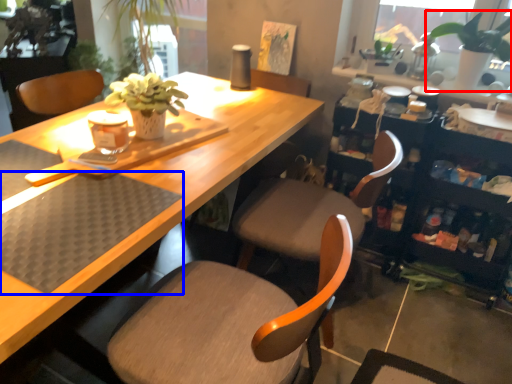
Question: Which object appears farthest to the camera in this image, houseplant (highlighted by a red box) or wide (highlighted by a blue box)?

Choices:
 (A) houseplant
 (B) wide

Answer: (A)